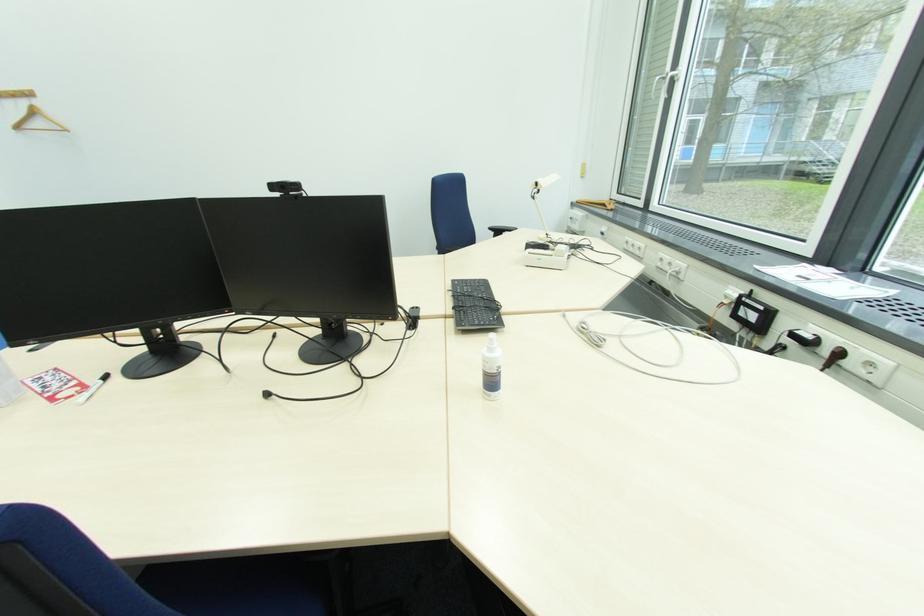
The location [475,305] corresponds to which object?

This point indicates the black keyboard.